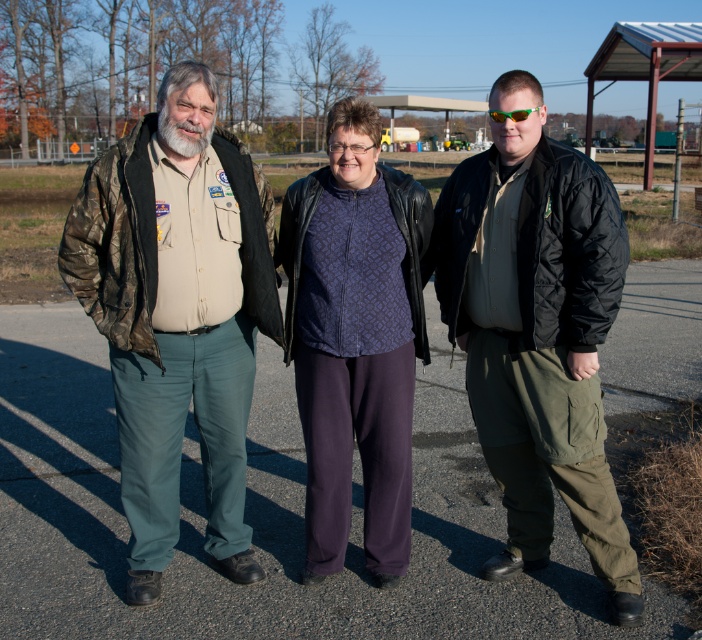
Is black quilted jacket at right bigger than purple patterned shirt at center?

Yes, black quilted jacket at right is bigger than purple patterned shirt at center.

This screenshot has width=702, height=640. Describe the element at coordinates (536, 333) in the screenshot. I see `black quilted jacket at right` at that location.

Between point (559, 461) and point (388, 246), which one is positioned in front?

Positioned in front is point (559, 461).

Where is `black quilted jacket at right`? The image size is (702, 640). black quilted jacket at right is located at coordinates (536, 333).

Who is shorter, dark gray asphalt at center or black quilted jacket at right?

dark gray asphalt at center

Is point (416, 509) positioned behind point (557, 429)?

Yes, it is.

Find the location of a particular element. The width and height of the screenshot is (702, 640). dark gray asphalt at center is located at coordinates (258, 515).

Who is more distant from viewer, (192, 200) or (494, 148)?

The point (494, 148) is behind.

Does point (180, 131) come closer to viewer compared to point (512, 138)?

Yes, point (180, 131) is closer to viewer.

Find the location of a particular element. The image size is (702, 640). camo jacket at left is located at coordinates (178, 314).